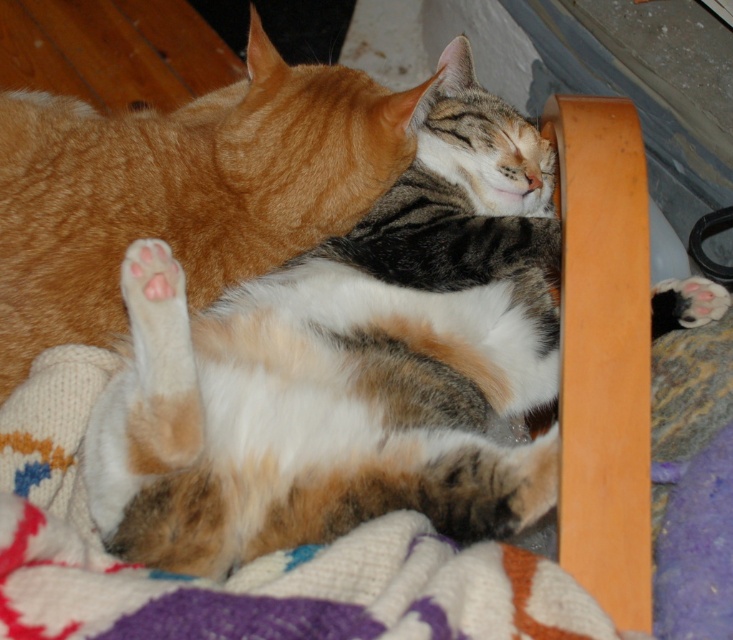
Can you confirm if orange tabby cat at upper center is thinner than pink soft fur paw at lower left?

No, orange tabby cat at upper center is not thinner than pink soft fur paw at lower left.

Does orange tabby cat at upper center have a greater height compared to pink soft fur paw at lower left?

Yes, orange tabby cat at upper center is taller than pink soft fur paw at lower left.

Which is behind, point (295, 154) or point (183, 282)?

Positioned behind is point (295, 154).

You are a GUI agent. You are given a task and a screenshot of the screen. Output one action in this format:
    pyautogui.click(x=<x>, y=<y>)
    Task: Click on the orange tabby cat at upper center
    This screenshot has width=733, height=640.
    Given the screenshot: What is the action you would take?
    pyautogui.click(x=180, y=189)

Can you confirm if orange tabby cat at upper center is smaller than white fur paw at lower right?

No.

Is point (92, 131) closer to camera compared to point (652, 294)?

No, it is not.

Is point (169, 128) positioned before point (685, 324)?

No, (169, 128) is behind (685, 324).

This screenshot has width=733, height=640. Identify the location of orange tabby cat at upper center. (180, 189).

Is pink soft fur paw at lower left wider than white fur paw at lower right?

Incorrect, pink soft fur paw at lower left's width does not surpass white fur paw at lower right's.

Does pink soft fur paw at lower left come in front of white fur paw at lower right?

No, pink soft fur paw at lower left is further to the viewer.

Who is more distant from viewer, (174, 305) or (710, 317)?

The point (710, 317) is behind.

Image resolution: width=733 pixels, height=640 pixels. In order to click on pink soft fur paw at lower left in this screenshot , I will do `click(152, 284)`.